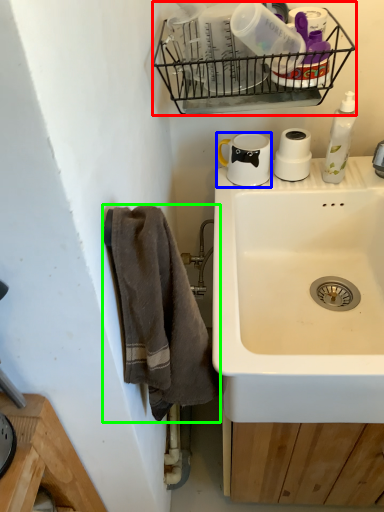
Question: Which object is the closest to the basket (highlighted by a red box)? Choose among these: coffee cup (highlighted by a blue box) or towel/napkin (highlighted by a green box).

Choices:
 (A) coffee cup
 (B) towel/napkin

Answer: (A)